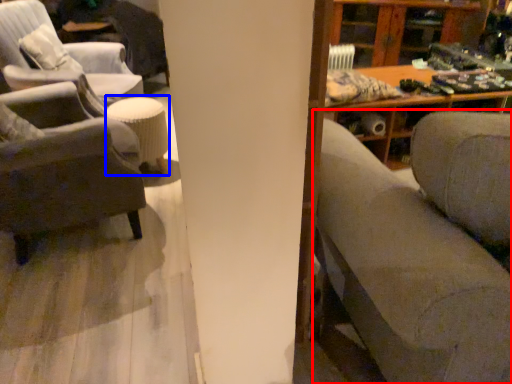
Question: Which object is further to the camera taking this photo, studio couch (highlighted by a red box) or stool (highlighted by a blue box)?

Choices:
 (A) studio couch
 (B) stool

Answer: (B)